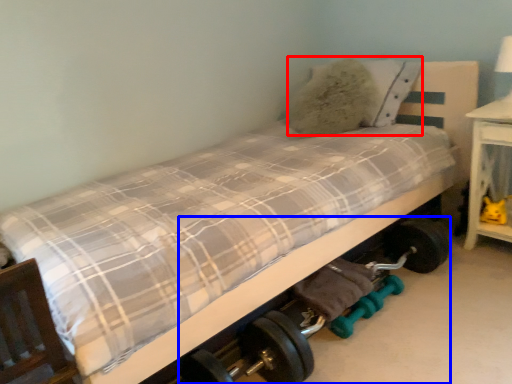
Question: Which object is closer to the camera taking this photo, pillow (highlighted by a red box) or baby carriage (highlighted by a blue box)?

Choices:
 (A) pillow
 (B) baby carriage

Answer: (B)